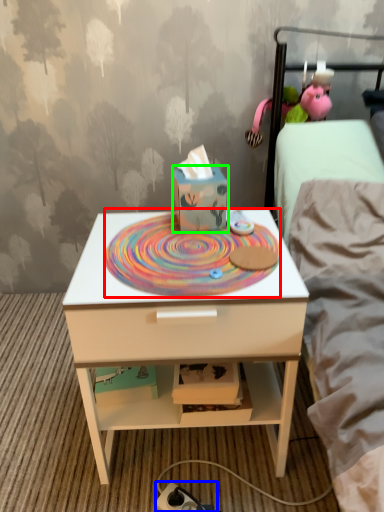
Question: Estimate the real-world distances between objects in this image. Which object is closer to design (highlighted by a red box), charger (highlighted by a blue box) or cardboard box (highlighted by a green box)?

Choices:
 (A) charger
 (B) cardboard box

Answer: (B)